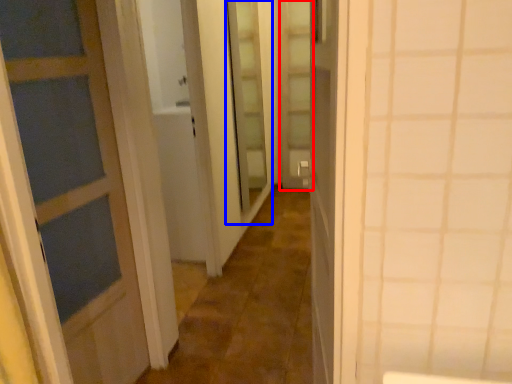
Question: Which object is further to the camera taking this photo, screen door (highlighted by a red box) or screen door (highlighted by a blue box)?

Choices:
 (A) screen door
 (B) screen door

Answer: (A)